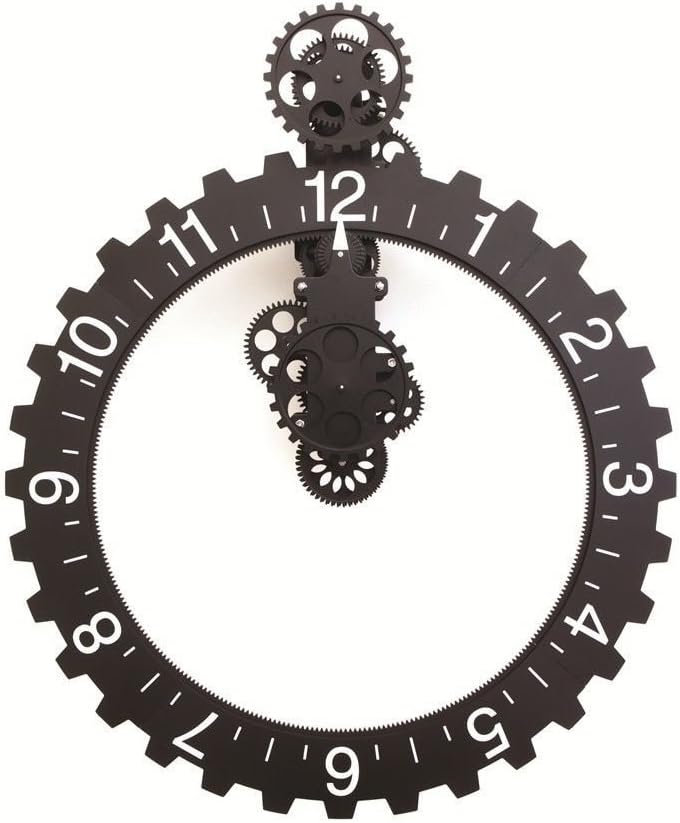
At what (x,y) coordinates should I click in order to perform the action: click on background top right of clock. Please return your answer as a coordinate pair (x, y). This screenshot has height=823, width=680. Looking at the image, I should click on (568, 78).